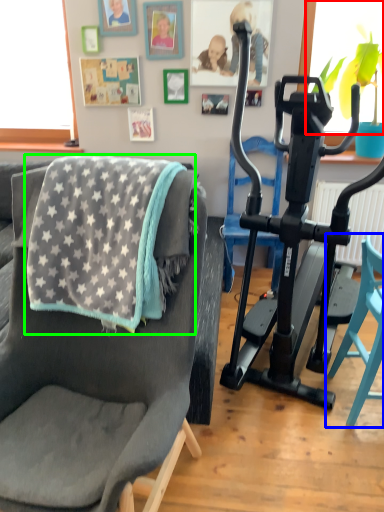
Question: Based on their relative distances, which object is nearer to window screen (highlighted by a red box)? Choose from chair (highlighted by a blue box) and blanket (highlighted by a green box).

Choices:
 (A) chair
 (B) blanket

Answer: (A)